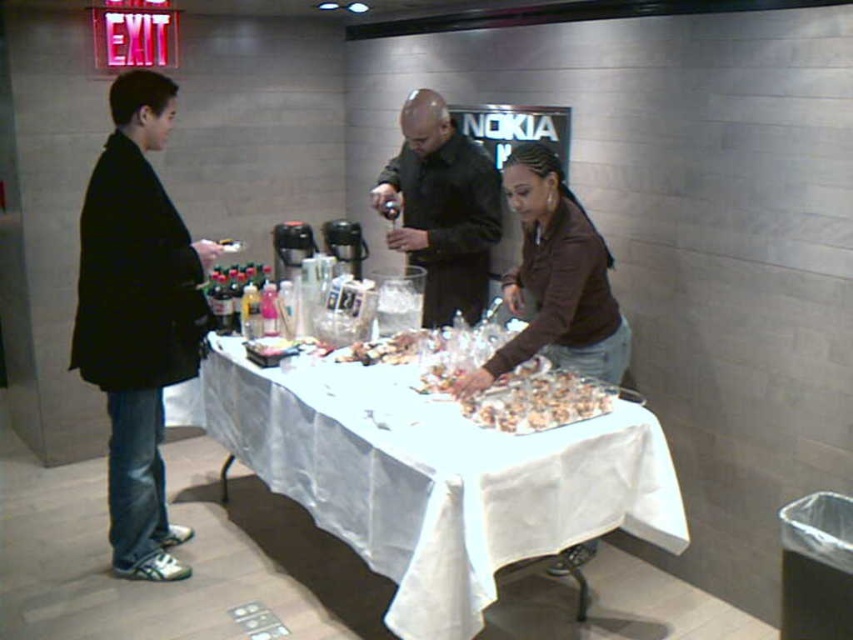
Question: Which object appears farthest from the camera in this image?

Choices:
 (A) black matte shirt at center
 (B) crumbly brown pastry at center
 (C) slightly browned plastic tray at center
 (D) black matte jacket at left

Answer: (A)

Question: Observing the image, what is the correct spatial positioning of white cloth-covered table at center in reference to black matte shirt at center?

Choices:
 (A) right
 (B) left

Answer: (B)

Question: Is white cloth-covered table at center thinner than black matte jacket at left?

Choices:
 (A) no
 (B) yes

Answer: (A)

Question: Based on their relative distances, which object is farther from the black matte shirt at center?

Choices:
 (A) black matte jacket at left
 (B) crumbly brown pastry at center

Answer: (A)

Question: Which of the following is the closest to the observer?

Choices:
 (A) white cloth-covered table at center
 (B) black matte jacket at left
 (C) crumbly brown pastry at center

Answer: (A)

Question: Can you confirm if white cloth-covered table at center is positioned above black matte jacket at left?

Choices:
 (A) yes
 (B) no

Answer: (B)